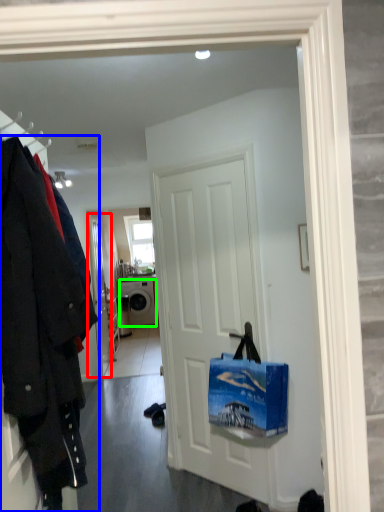
Question: Which is nearer to the door (highlighted by a red box)? coat (highlighted by a blue box) or washing machine (highlighted by a green box).

Choices:
 (A) coat
 (B) washing machine

Answer: (B)